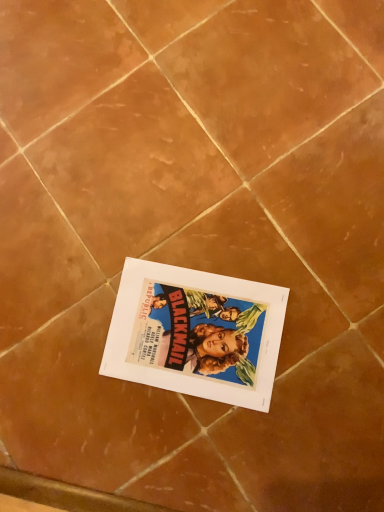
Where is `free space above matte paper poster at center (from a real-world perspective)`? free space above matte paper poster at center (from a real-world perspective) is located at coordinates (188, 332).